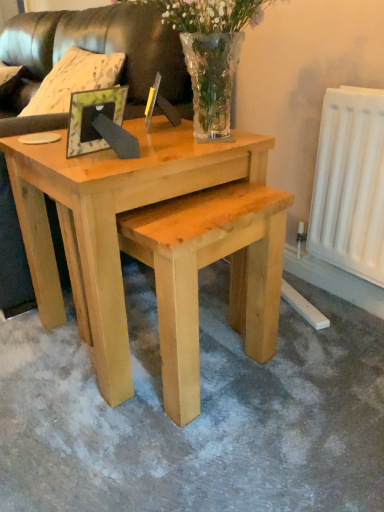
In order to click on free space to the left of green leafy frame at center in this screenshot , I will do `click(48, 158)`.